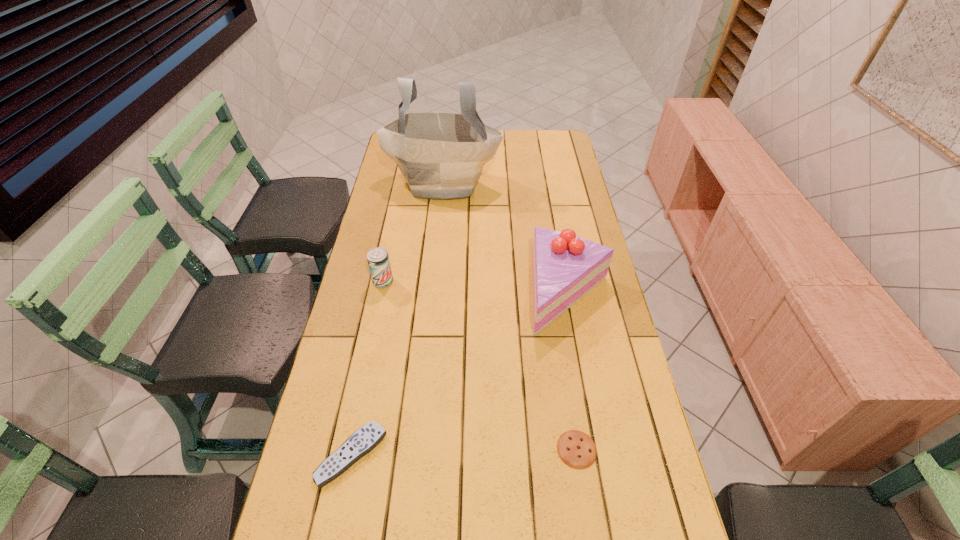
This screenshot has height=540, width=960. In order to click on free location located on the back of the cookie in this screenshot , I will do `click(556, 312)`.

Find the location of a particular element. shopping bag at the left edge is located at coordinates (441, 155).

Identify the location of beer can that is positioned at the left edge. [378, 260].

Locate an element on the screen. The height and width of the screenshot is (540, 960). remote control at the left edge is located at coordinates (366, 438).

Image resolution: width=960 pixels, height=540 pixels. Identify the location of cake situated at the right edge. (565, 267).

Locate an element on the screen. The image size is (960, 540). cookie at the right edge is located at coordinates (576, 449).

Image resolution: width=960 pixels, height=540 pixels. What are the coordinates of `vacant space at the far edge of the desktop` in the screenshot? It's located at (511, 140).

Where is `vacant space at the left edge`? Image resolution: width=960 pixels, height=540 pixels. vacant space at the left edge is located at coordinates (396, 266).

Where is `free space at the right edge of the desktop`? free space at the right edge of the desktop is located at coordinates (611, 329).

I want to click on free space between the cookie and the third shortest object, so click(480, 366).